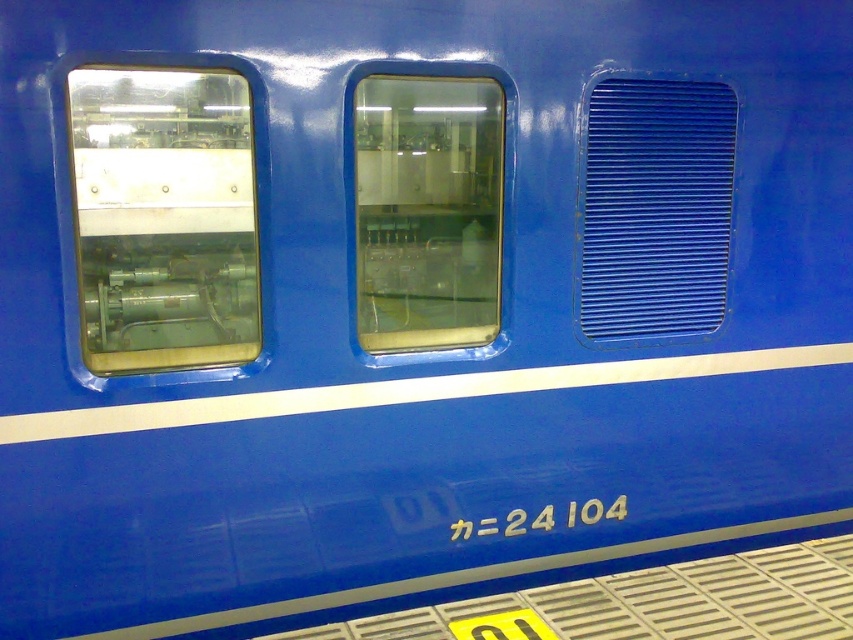
Find the location of a particular element. The height and width of the screenshot is (640, 853). transparent glass window at left is located at coordinates (163, 218).

Does transparent glass window at left have a greater height compared to blue textured vent at right?

No.

Does point (195, 211) come closer to viewer compared to point (729, 179)?

Yes, it is.

This screenshot has width=853, height=640. Identify the location of transparent glass window at left. click(x=163, y=218).

Does transparent glass window at left have a greater height compared to transparent glass window at center?

In fact, transparent glass window at left may be shorter than transparent glass window at center.

Who is more forward, [88,305] or [445,280]?

Point [88,305]

You are a GUI agent. You are given a task and a screenshot of the screen. Output one action in this format:
    pyautogui.click(x=<x>, y=<y>)
    Task: Click on the transparent glass window at left
    The height and width of the screenshot is (640, 853).
    Given the screenshot: What is the action you would take?
    pyautogui.click(x=163, y=218)

Describe the element at coordinates (427, 211) in the screenshot. The width and height of the screenshot is (853, 640). I see `transparent glass window at center` at that location.

Is transparent glass window at center smaller than blue textured vent at right?

Correct, transparent glass window at center occupies less space than blue textured vent at right.

Between point (462, 296) and point (694, 280), which one is positioned in front?

Point (462, 296)

Where is `transparent glass window at center`? Image resolution: width=853 pixels, height=640 pixels. transparent glass window at center is located at coordinates (427, 211).